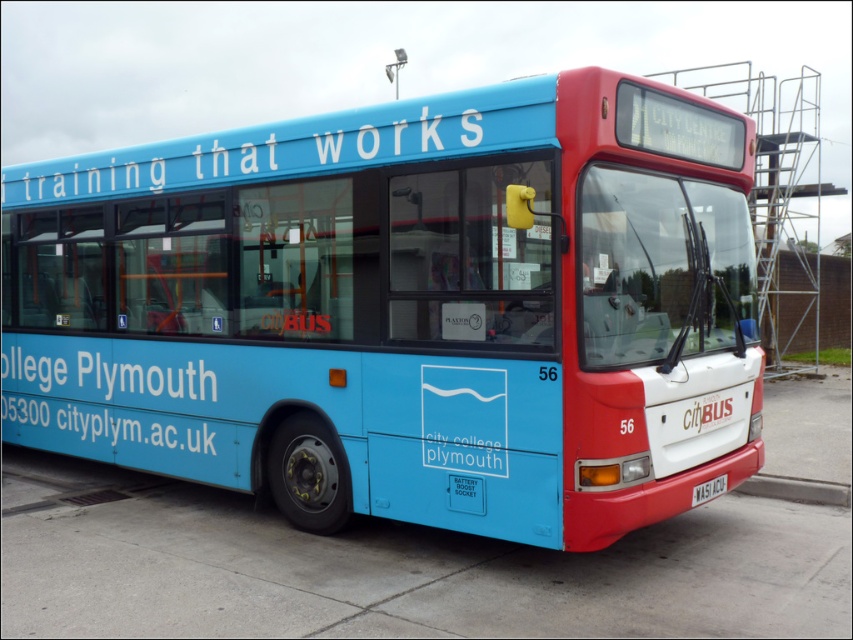
You are a pedestrian standing in front of the city bus and want to read both the blue matte text at lower left and the black plastic license plate at lower right. Which one should you look at first to read both without moving your head?

You should look at the blue matte text at lower left first because it is to the left of the black plastic license plate at lower right, so by starting from the left, you can read both without moving your head.

You are a delivery person who needs to place a package on the bus. The package requires a space of at least 5 meters between two specific points on the bus. Can you determine if the distance between the blue matte text at lower left and the black plastic license plate at lower right is sufficient?

The blue matte text at lower left is 5.25 meters from the black plastic license plate at lower right, so the distance is sufficient as it exceeds the required 5 meters.

You are a delivery person who needs to load a 5.5 meter long crate onto the matte blue bus at center. Can you fit the crate if you place it diagonally across the bus?

The crate is 5.5 meters long, which is longer than the 5.31 meters between the objects, so it won not fit diagonally.